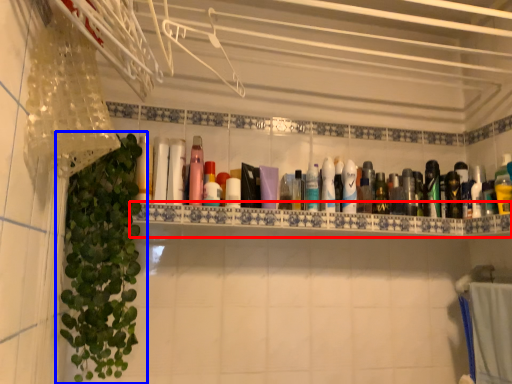
Question: Among these objects, which one is farthest to the camera, shelve (highlighted by a red box) or houseplant (highlighted by a blue box)?

Choices:
 (A) shelve
 (B) houseplant

Answer: (A)